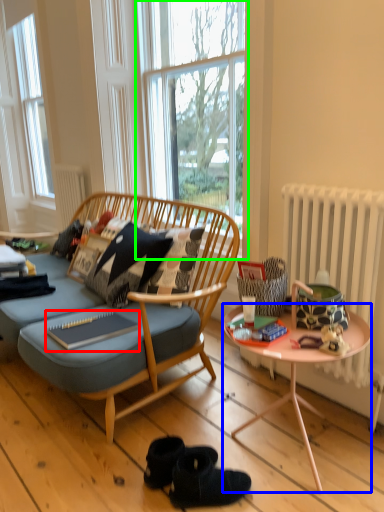
Question: Which is farther away from magazine (highlighted by a red box)? desk (highlighted by a blue box) or window (highlighted by a green box)?

Choices:
 (A) desk
 (B) window

Answer: (B)